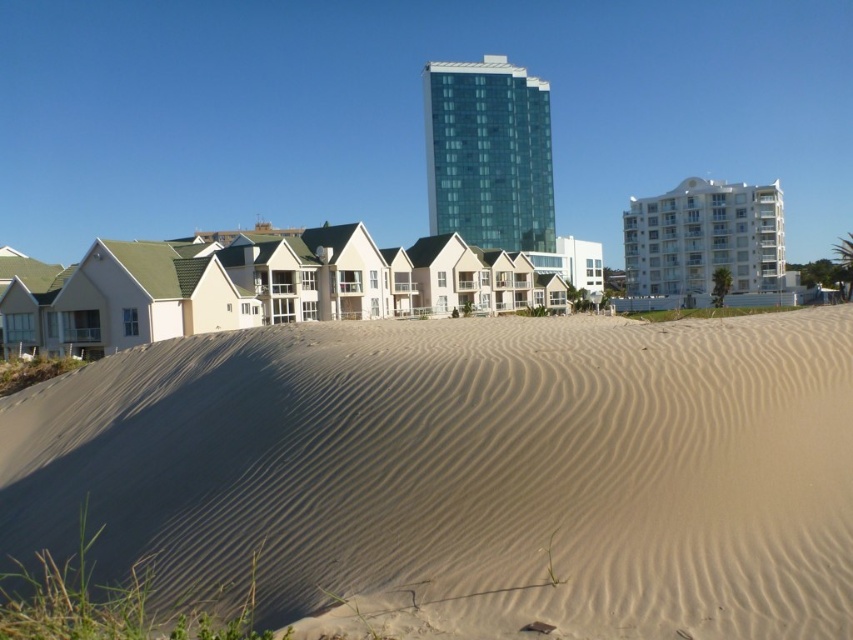
Is light beige sand at center taller than white glossy building at upper right?

No.

Which is behind, point (405, 445) or point (704, 275)?

Point (704, 275)

Does point (305, 561) lie behind point (730, 184)?

No, (305, 561) is in front of (730, 184).

Locate an element on the screen. light beige sand at center is located at coordinates [x=465, y=470].

Can you confirm if light beige sand at center is smaller than beige wood houses at center?

Yes, light beige sand at center is smaller than beige wood houses at center.

Does point (447, 614) come in front of point (514, 278)?

Yes, it is in front of point (514, 278).

I want to click on light beige sand at center, so click(x=465, y=470).

Can you confirm if beige wood houses at center is positioned above green glass building at center?

Actually, beige wood houses at center is below green glass building at center.

Can you confirm if beige wood houses at center is taller than green glass building at center?

No, beige wood houses at center is not taller than green glass building at center.

Locate an element on the screen. beige wood houses at center is located at coordinates (258, 288).